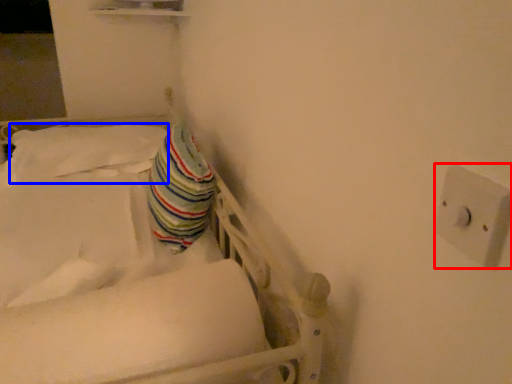
Question: Which point is closer to the camera, electric outlet (highlighted by a red box) or pillow (highlighted by a blue box)?

Choices:
 (A) electric outlet
 (B) pillow

Answer: (A)